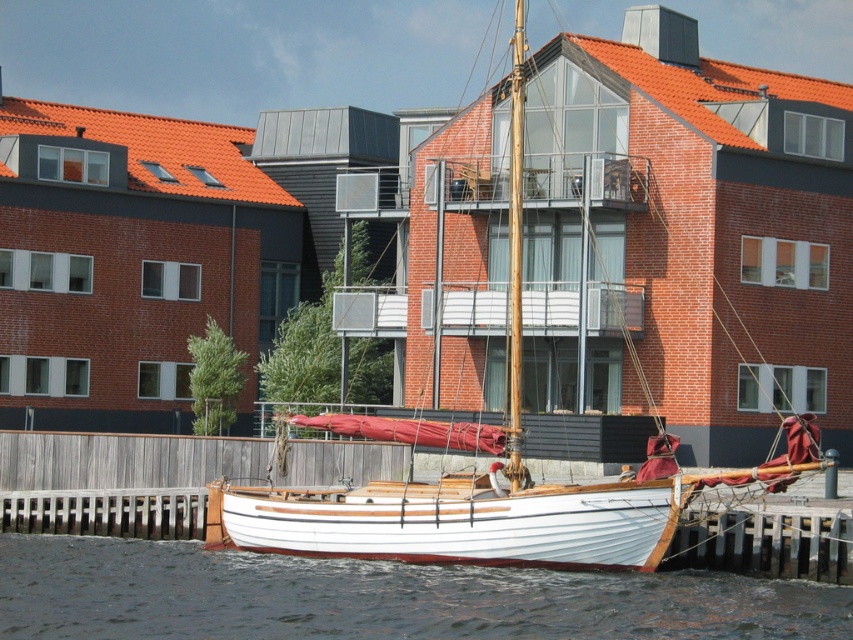
You are a photographer planning to capture the white wood sailboat at center and the white smooth water at lower center in a single frame. Given that the camera lens has a fixed width capacity, can both objects fit side by side without cropping?

The white wood sailboat at center is wider than the white smooth water at lower center. Since the sailboat is wider, it may occupy more of the frame, potentially making it difficult to fit both objects side by side without cropping. However, the exact feasibility depends on the lens width and their combined width relative to the camera sensor. Without specific measurements, it is challenging to confirm, but the sailboat being wider suggests it might require careful framing.

You are standing on the wooden pier and want to board the white wood sailboat at center. Can you step directly from the wooden pier onto the white smooth water at lower center to reach the boat?

The white wood sailboat at center is taller than the white smooth water at lower center, so stepping onto the water would not be possible as it is lower. You should board the boat directly from the pier.

You are standing on the wooden pier and want to walk to the white wood sailboat at center. There is a section of white smooth water at lower center between you and the boat. Can you safely step onto the sailboat without getting your feet wet?

The white wood sailboat at center is further to the viewer than the white smooth water at lower center, meaning the boat is closer to you. Therefore, you can safely step onto the white wood sailboat at center without stepping into the water.